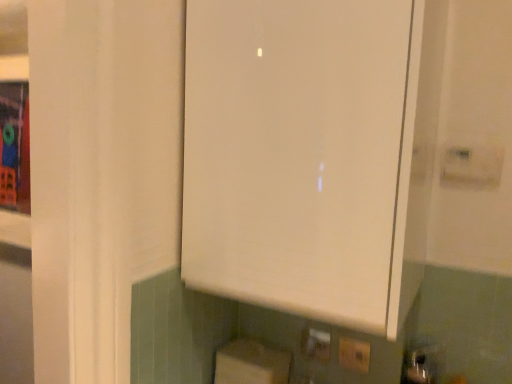
Question: Looking at the image, does yellow plastic electric outlet at lower center, which appears as the first electric outlet when viewed from the back, seem bigger or smaller compared to white cardboard box at lower center?

Choices:
 (A) big
 (B) small

Answer: (B)

Question: Is point (320, 344) closer or farther from the camera than point (220, 365)?

Choices:
 (A) closer
 (B) farther

Answer: (B)

Question: Estimate the real-world distances between objects in this image. Which object is farther from the yellow plastic electric outlet at lower center, placed as the second electric outlet when sorted from front to back?

Choices:
 (A) white plastic electric outlet at lower center, which is the 2th electric outlet in left-to-right order
 (B) white cardboard box at lower center
 (C) white matte cabinet at center

Answer: (C)

Question: Which object is positioned closest to the yellow plastic electric outlet at lower center, which appears as the first electric outlet when viewed from the back?

Choices:
 (A) white cardboard box at lower center
 (B) white matte cabinet at center
 (C) white plastic electric outlet at lower center, which is the 2th electric outlet in left-to-right order

Answer: (C)